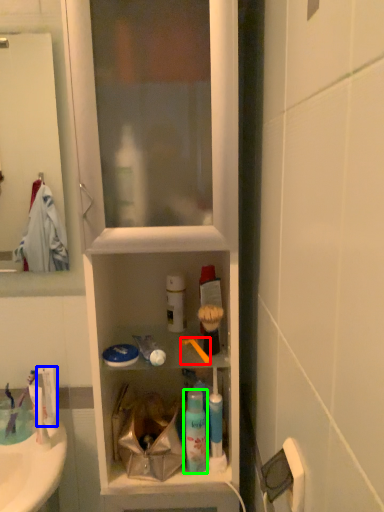
Question: Which object is the closest to the brush (highlighted by a red box)? Choose among these: toothpaste (highlighted by a blue box) or mouthwash (highlighted by a green box).

Choices:
 (A) toothpaste
 (B) mouthwash

Answer: (B)